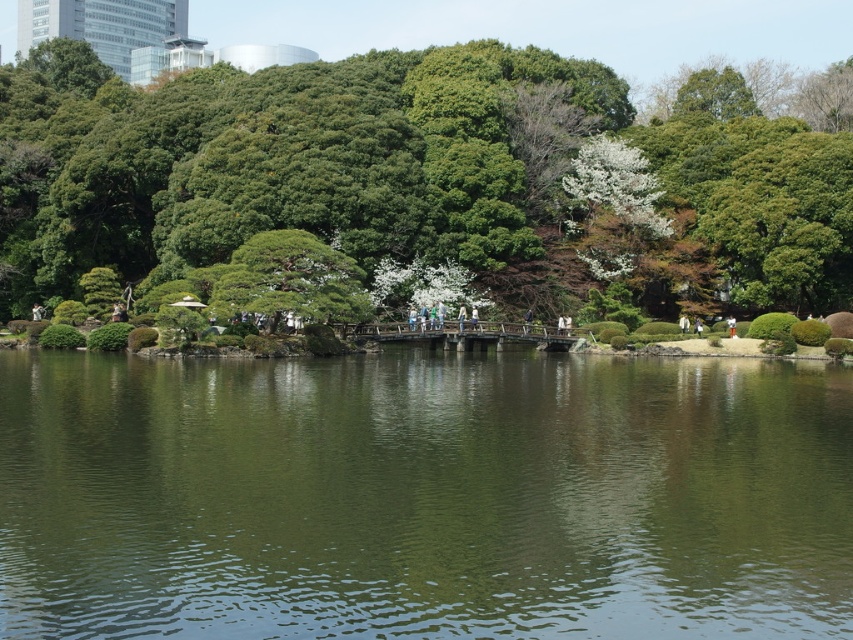
Which of these two, green reflective water at center or green leafy tree at center, stands taller?

Standing taller between the two is green leafy tree at center.

Does point (686, 483) lie behind point (732, 128)?

No, it is in front of (732, 128).

Where is `green reflective water at center`? green reflective water at center is located at coordinates click(422, 497).